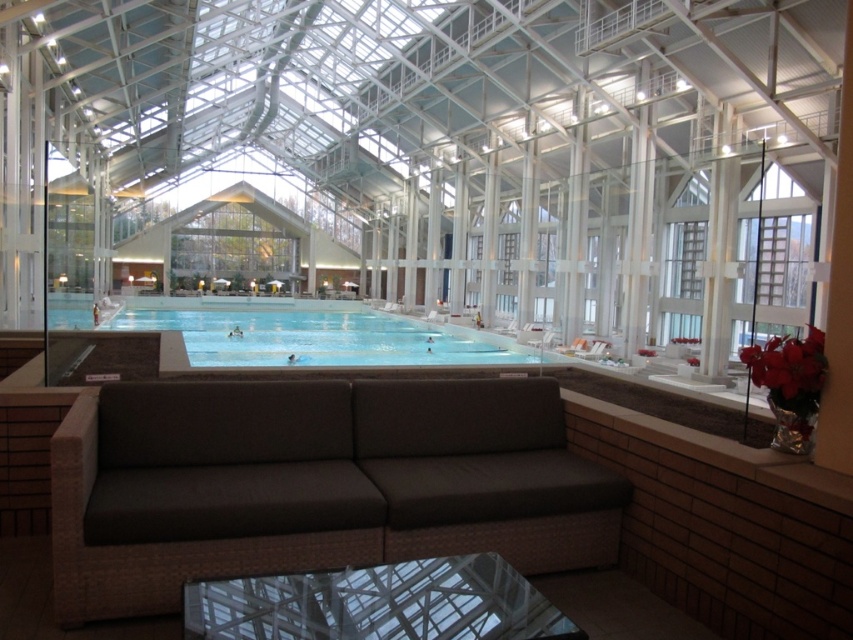
You are a guest at this poolside lounge and want to place a tray of drinks on the transparent glass table at lower center without blocking the view of the clear blue water at center. Is this possible?

The transparent glass table at lower center is in front of the clear blue water at center, so placing the drinks on the table will block the view of the clear blue water at center. Therefore, it is not possible to place the tray without blocking the view.

You are standing in the swimming pool area and want to move from one point to another. Which point, point (453, 499) or point (194, 346), is closer to you?

Point (453, 499) is closer to the viewer than point (194, 346).